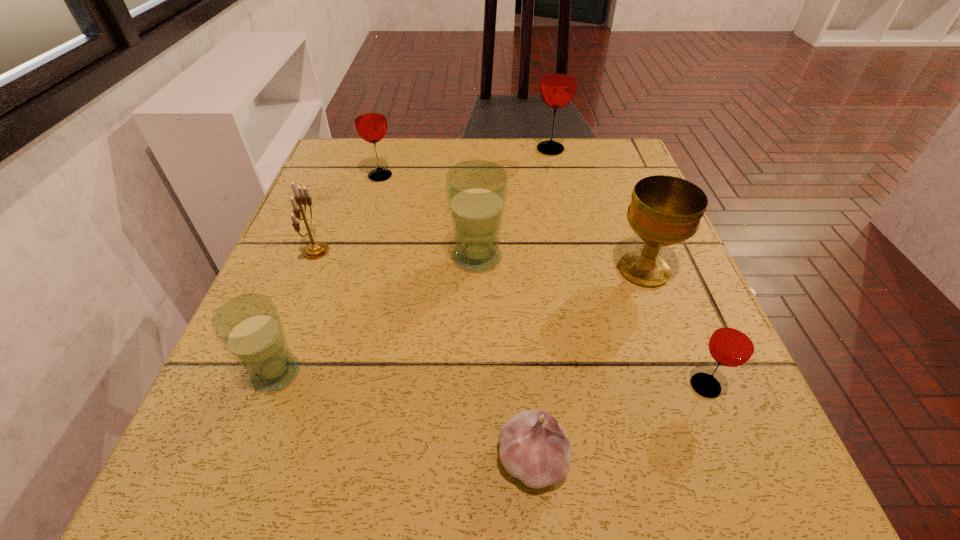
Find the location of `free location located on the left of the smallest red glass`. free location located on the left of the smallest red glass is located at coordinates [x=653, y=386].

Where is `free space located on the left of the garlic`? This screenshot has height=540, width=960. free space located on the left of the garlic is located at coordinates (204, 458).

At what (x,y) coordinates should I click in order to perform the action: click on object at the near edge. Please return your answer as a coordinate pair (x, y). Looking at the image, I should click on (534, 448).

At what (x,y) coordinates should I click in order to perform the action: click on candelabrum that is at the left edge. Please return your answer as a coordinate pair (x, y). This screenshot has height=540, width=960. Looking at the image, I should click on (314, 250).

You are a GUI agent. You are given a task and a screenshot of the screen. Output one action in this format:
    pyautogui.click(x=<x>, y=<y>)
    Task: Click on the chalice positioned at the right edge
    Image resolution: width=960 pixels, height=540 pixels.
    Given the screenshot: What is the action you would take?
    pyautogui.click(x=664, y=210)

Locate an element on the screen. object located at the far left corner is located at coordinates (370, 121).

Where is `object that is at the far right corner`? object that is at the far right corner is located at coordinates (558, 82).

Locate an element on the screen. The image size is (960, 540). blank space at the far edge of the desktop is located at coordinates (509, 174).

Identify the location of free location at the near edge. (443, 500).

The height and width of the screenshot is (540, 960). In order to click on vacant space at the left edge of the desktop in this screenshot , I will do `click(370, 222)`.